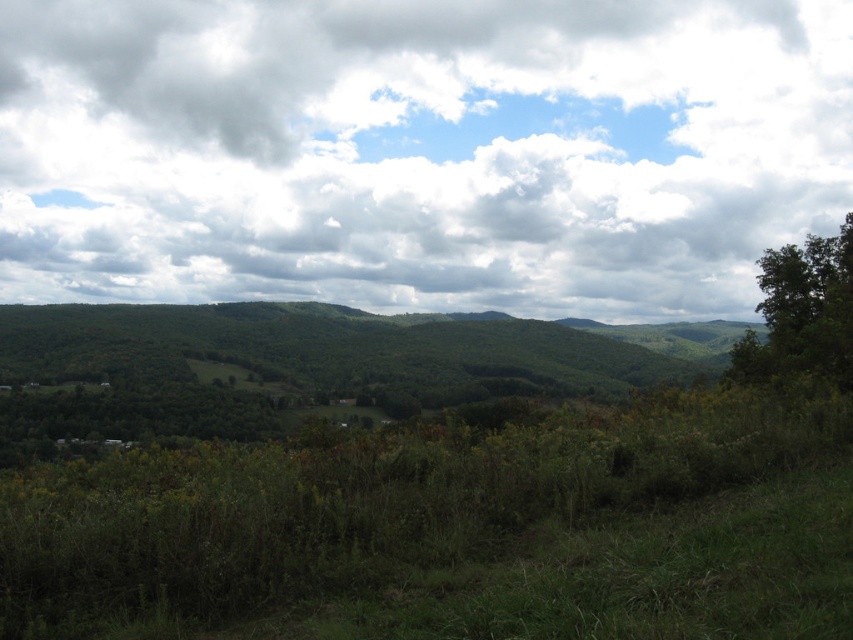
Question: Which point is closer to the camera taking this photo?

Choices:
 (A) (219, 163)
 (B) (778, 304)

Answer: (B)

Question: Can you confirm if white fluffy cloud at upper center is positioned to the left of green leafy tree at right?

Choices:
 (A) no
 (B) yes

Answer: (B)

Question: Can you confirm if white fluffy cloud at upper center is positioned above green leafy tree at right?

Choices:
 (A) no
 (B) yes

Answer: (B)

Question: Does white fluffy cloud at upper center appear on the right side of green leafy tree at right?

Choices:
 (A) no
 (B) yes

Answer: (A)